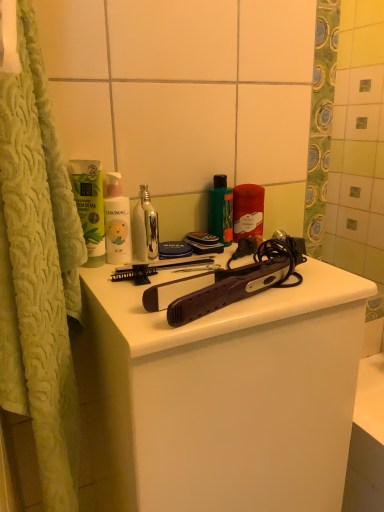
Question: Is white matte bottle at center, which ranks as the first cleaning product in left-to-right order, inside or outside of metallic silver bottle at center, the second mouthwash when ordered from right to left?

Choices:
 (A) inside
 (B) outside

Answer: (B)

Question: Considering the positions of point (107, 231) and point (137, 223), is point (107, 231) closer or farther from the camera than point (137, 223)?

Choices:
 (A) closer
 (B) farther

Answer: (A)

Question: Which object is the farthest from the matte red candle at center, acting as the 2th cleaning product starting from the front?

Choices:
 (A) metallic silver bottle at center, arranged as the second mouthwash when viewed from the left
 (B) white matte bottle at center, which ranks as the first cleaning product in left-to-right order
 (C) green matte tube at upper left, which ranks as the 3th mouthwash in right-to-left order
 (D) matte black hair straightener at center
 (E) green glossy bottle at center, which is counted as the first mouthwash, starting from the right

Answer: (D)

Question: Considering the real-world distances, which object is closest to the matte black hair straightener at center?

Choices:
 (A) green matte tube at upper left, which ranks as the 3th mouthwash in right-to-left order
 (B) matte red candle at center, the first cleaning product viewed from the back
 (C) white matte bottle at center, the first cleaning product positioned from the front
 (D) metallic silver bottle at center, arranged as the second mouthwash when viewed from the left
 (E) green glossy bottle at center, which appears as the third mouthwash when viewed from the left

Answer: (D)